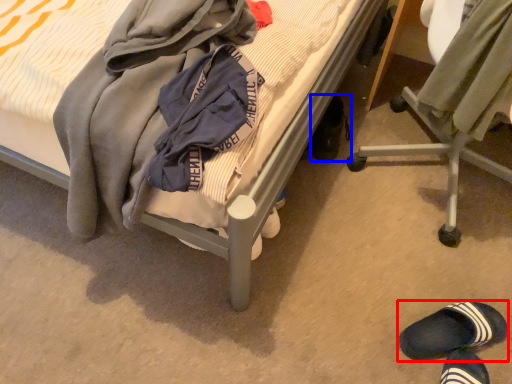
Question: Which point is further to the camera, footwear (highlighted by a red box) or footwear (highlighted by a blue box)?

Choices:
 (A) footwear
 (B) footwear

Answer: (B)